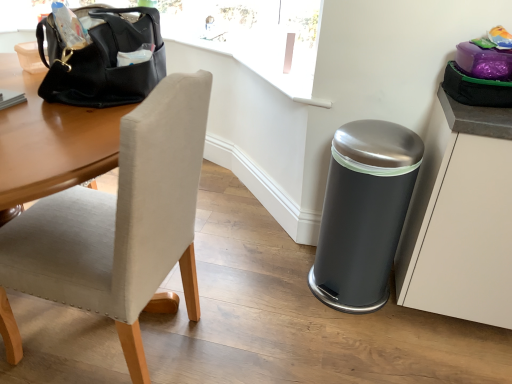
Question: Considering the relative positions of satin silver trash can at lower right and white matte cabinet at right in the image provided, is satin silver trash can at lower right to the left of white matte cabinet at right from the viewer's perspective?

Choices:
 (A) no
 (B) yes

Answer: (B)

Question: From the image's perspective, is satin silver trash can at lower right located above white matte cabinet at right?

Choices:
 (A) yes
 (B) no

Answer: (A)

Question: Considering the relative sizes of satin silver trash can at lower right and white matte cabinet at right in the image provided, is satin silver trash can at lower right thinner than white matte cabinet at right?

Choices:
 (A) yes
 (B) no

Answer: (A)

Question: Considering the relative sizes of satin silver trash can at lower right and white matte cabinet at right in the image provided, is satin silver trash can at lower right wider than white matte cabinet at right?

Choices:
 (A) yes
 (B) no

Answer: (B)

Question: From the image's perspective, is satin silver trash can at lower right under white matte cabinet at right?

Choices:
 (A) no
 (B) yes

Answer: (A)

Question: Considering the positions of point (494, 109) and point (400, 157), is point (494, 109) closer or farther from the camera than point (400, 157)?

Choices:
 (A) farther
 (B) closer

Answer: (B)

Question: From the image's perspective, is white matte cabinet at right above or below satin silver trash can at lower right?

Choices:
 (A) above
 (B) below

Answer: (B)

Question: In terms of width, does white matte cabinet at right look wider or thinner when compared to satin silver trash can at lower right?

Choices:
 (A) wide
 (B) thin

Answer: (A)

Question: Visually, is white matte cabinet at right positioned to the left or to the right of satin silver trash can at lower right?

Choices:
 (A) right
 (B) left

Answer: (A)

Question: Based on their positions, is satin silver trash can at lower right located to the left or right of black leather handbag at upper left?

Choices:
 (A) right
 (B) left

Answer: (A)

Question: In terms of size, does satin silver trash can at lower right appear bigger or smaller than black leather handbag at upper left?

Choices:
 (A) big
 (B) small

Answer: (A)

Question: Is satin silver trash can at lower right inside or outside of black leather handbag at upper left?

Choices:
 (A) inside
 (B) outside

Answer: (B)

Question: Is satin silver trash can at lower right wider or thinner than black leather handbag at upper left?

Choices:
 (A) wide
 (B) thin

Answer: (A)

Question: In terms of width, does black leather handbag at upper left look wider or thinner when compared to satin silver trash can at lower right?

Choices:
 (A) thin
 (B) wide

Answer: (A)

Question: Relative to satin silver trash can at lower right, is black leather handbag at upper left in front or behind?

Choices:
 (A) behind
 (B) front

Answer: (B)